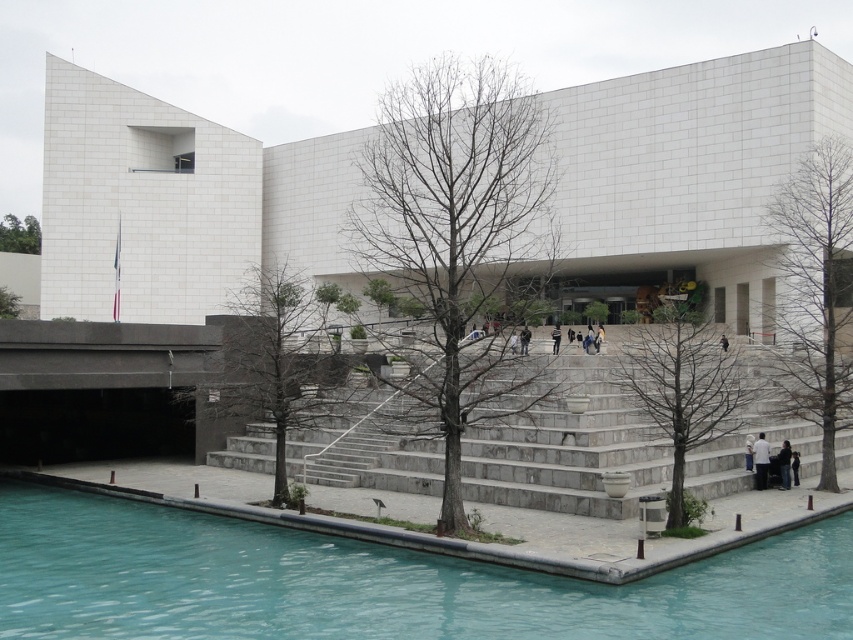
You are standing at the bottom of the steps leading to the building. You want to walk towards the brown bark tree at right without stepping into the clear blue water at bottom left. Which direction should you move relative to the steps?

You should move to the right side of the steps because the clear blue water at bottom left is located to the left of the brown bark tree at right, so moving right will keep you away from the water.

You are standing in front of the building and want to take a photo of both the bare branches at center and the black cotton shirt at center. Which object should you focus on first to ensure both are in clear view?

You should focus on the bare branches at center first because it is closer to the viewer than the black cotton shirt at center, so adjusting focus from near to far will help both objects be in clear view.